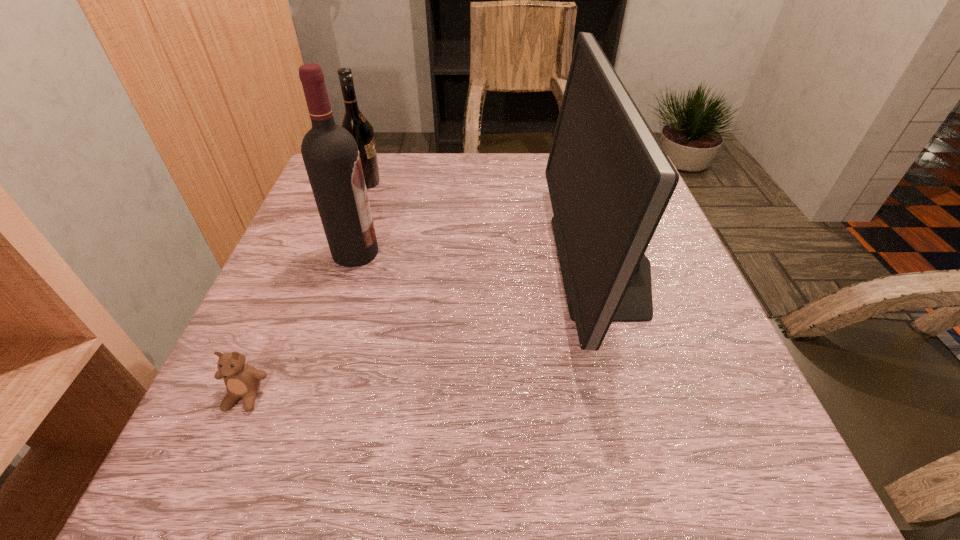
Identify the location of the nearer wine bottle. (330, 153).

What are the coordinates of `computer monitor` in the screenshot? It's located at (609, 180).

What are the coordinates of `the shorter wine bottle` in the screenshot? It's located at (353, 121).

Identify the location of the farther wine bottle. Image resolution: width=960 pixels, height=540 pixels. (353, 121).

Where is `the shortest object`? Image resolution: width=960 pixels, height=540 pixels. the shortest object is located at coordinates (242, 380).

Identify the location of teddy bear. The image size is (960, 540). (242, 380).

Identify the location of blank space located on the label of the taller wine bottle. (551, 253).

Where is `blank space located 0.350m on the screen side of the computer monitor`? This screenshot has width=960, height=540. blank space located 0.350m on the screen side of the computer monitor is located at coordinates (389, 264).

The width and height of the screenshot is (960, 540). Identify the location of free space located on the screen side of the computer monitor. (522, 264).

Identify the location of vacant region located 0.130m on the screen side of the computer monitor. The width and height of the screenshot is (960, 540). (493, 264).